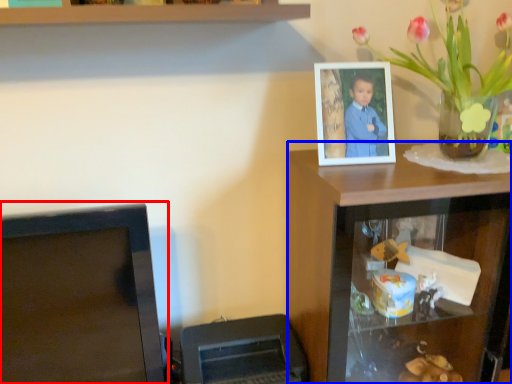
Question: Which object is closer to the camera taking this photo, computer monitor (highlighted by a red box) or computer desk (highlighted by a blue box)?

Choices:
 (A) computer monitor
 (B) computer desk

Answer: (A)